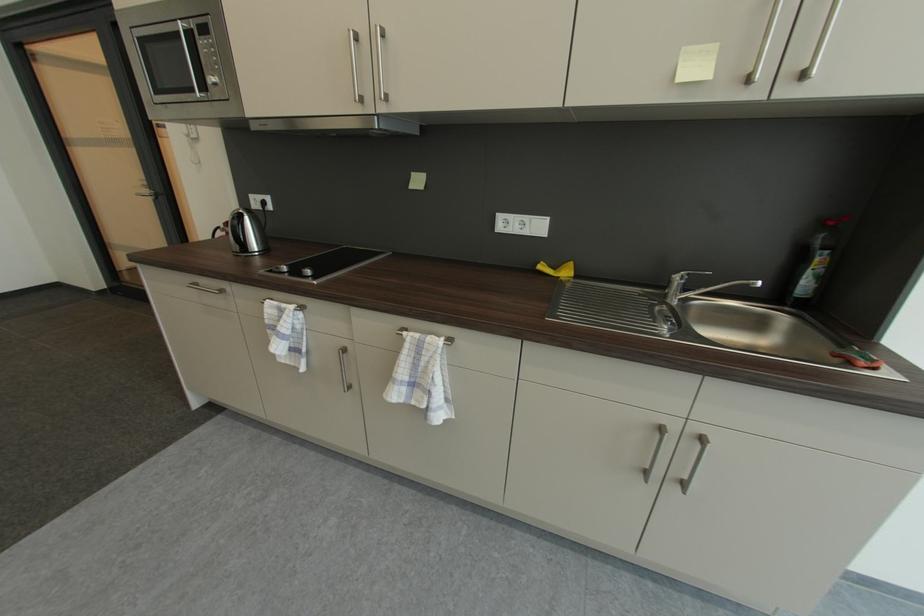
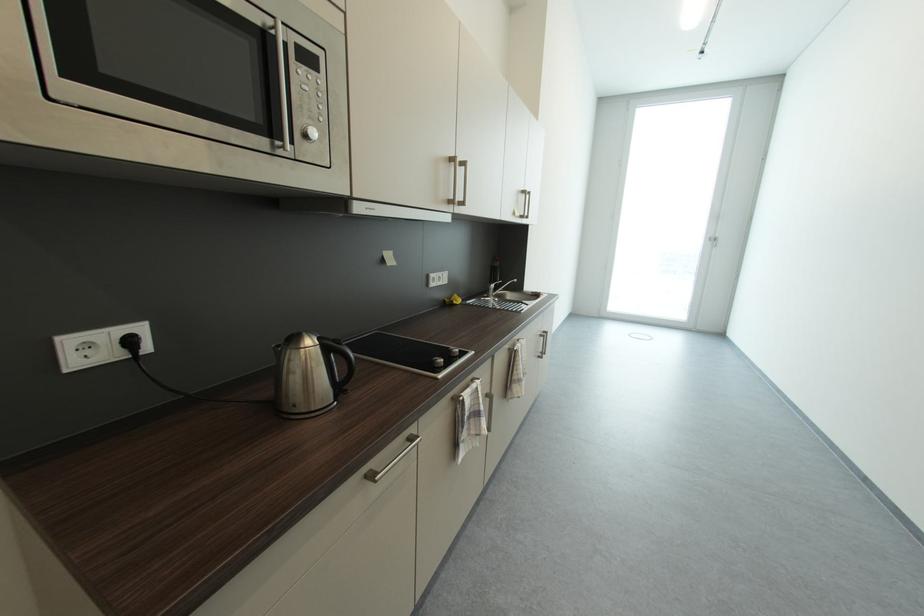
Where in the second image is the point corresponding to the point at 407,337 from the first image?

(523, 351)